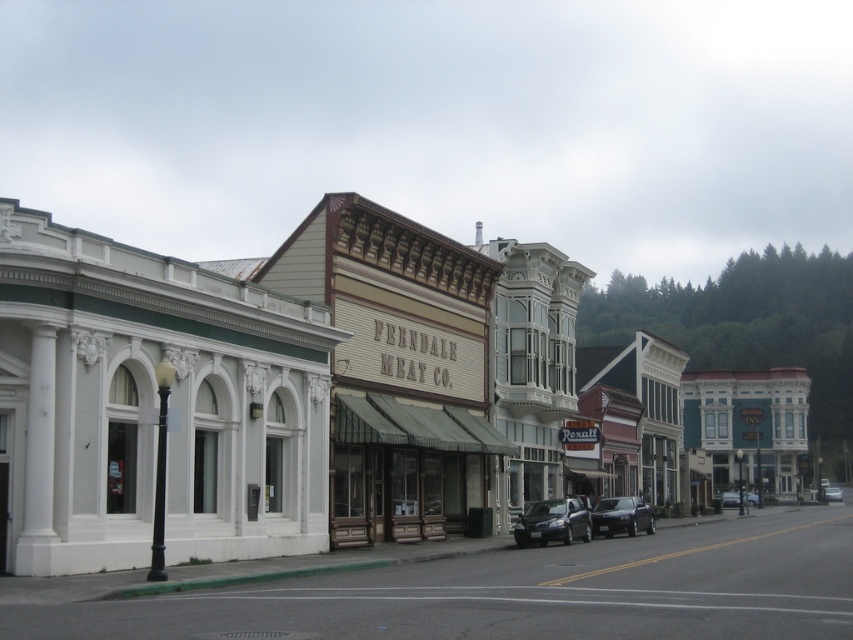
You are driving a shiny black sedan at center and want to park it in front of the white painted building at center. Is there enough space for the sedan to fit in front of the building?

The white painted building at center has a larger size compared to the shiny black sedan at center, so there should be enough space for the sedan to fit in front of the building.

You are a pedestrian standing on the street and see the white painted building at center and the metallic blue sedan at center. Which object is closer to you?

The white painted building at center is closer to you because it is in front of the metallic blue sedan at center.

You are standing on the quaint street and want to take a photo. There are two points of interest marked as point 1 at coordinates (54, 531) and point 2 at coordinates (741, 496). Which point will appear larger in your camera view?

Point 1 at coordinates (54, 531) will appear larger in the camera view because it is closer to the viewer than point 2 at coordinates (741, 496).